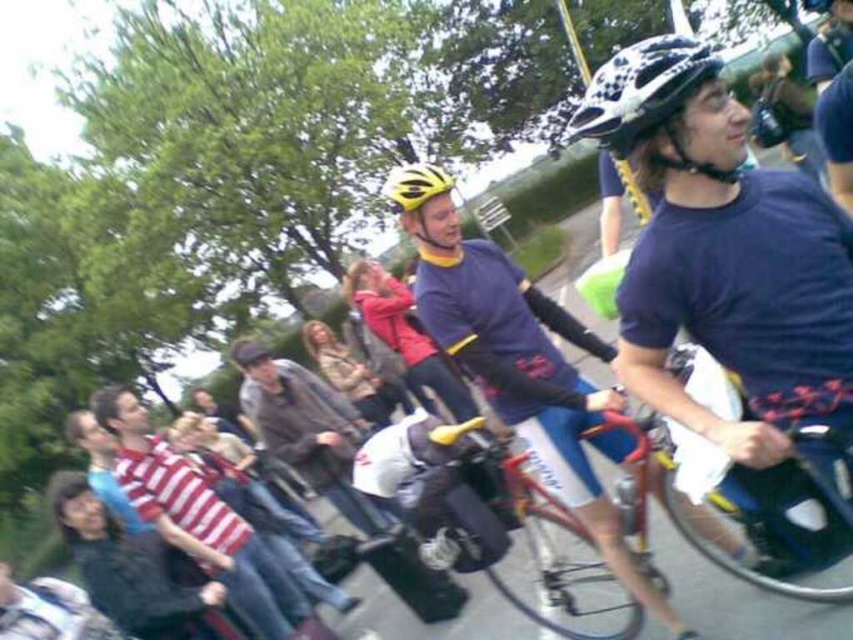
Question: Can you confirm if matte purple shirt at center is wider than matte black helmet at upper right?

Choices:
 (A) yes
 (B) no

Answer: (A)

Question: Which point is farther to the camera?

Choices:
 (A) shiny metallic bicycle at center
 (B) matte purple shirt at center
 (C) yellow matte helmet at center
 (D) dark brown leather jacket at center

Answer: (C)

Question: Does dark gray sweater at lower left have a larger size compared to leather jacket at center?

Choices:
 (A) yes
 (B) no

Answer: (B)

Question: Is shiny metallic bicycle at center to the left of yellow matte helmet at center from the viewer's perspective?

Choices:
 (A) no
 (B) yes

Answer: (A)

Question: Which point is farther from the camera taking this photo?

Choices:
 (A) (434, 387)
 (B) (404, 164)

Answer: (A)

Question: Among these objects, which one is farthest from the camera?

Choices:
 (A) shiny metallic bicycle at center
 (B) leather jacket at center
 (C) dark gray sweater at lower left
 (D) dark brown leather jacket at center

Answer: (B)